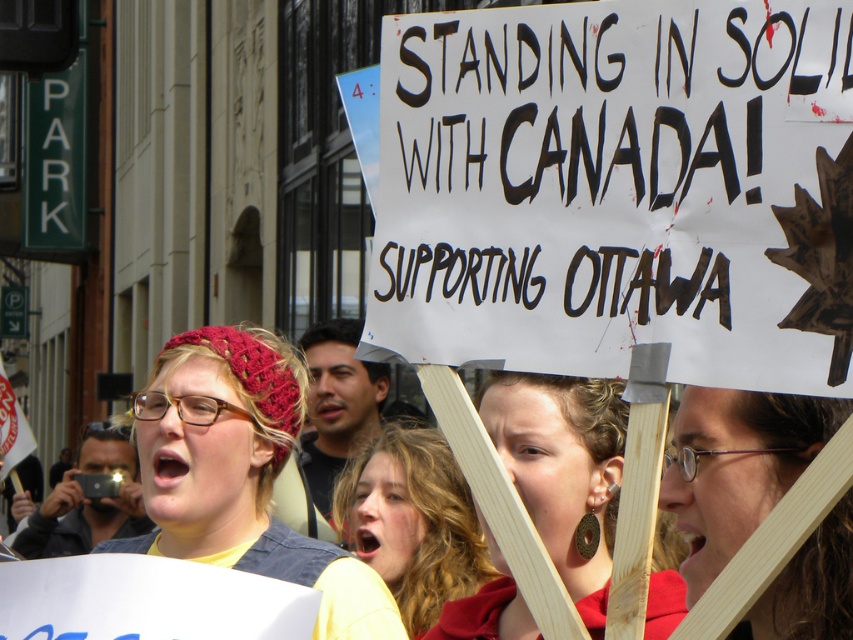
Is point (189, 481) behind point (431, 609)?

No.

Which is behind, point (297, 566) or point (415, 456)?

Positioned behind is point (415, 456).

You are a GUI agent. You are given a task and a screenshot of the screen. Output one action in this format:
    pyautogui.click(x=<x>, y=<y>)
    Task: Click on the knitted red beanie at center
    The width and height of the screenshot is (853, 640).
    Given the screenshot: What is the action you would take?
    click(239, 474)

Is the position of knitted red beanie at center less distant than that of wooden sign at center?

No, it is not.

Who is positioned more to the left, knitted red beanie at center or wooden sign at center?

Positioned to the left is knitted red beanie at center.

Is point (350, 588) positioned in front of point (534, 406)?

No, (350, 588) is further to viewer.

Locate an element on the screen. knitted red beanie at center is located at coordinates (239, 474).

Find the location of `wooden sign at center`. wooden sign at center is located at coordinates (563, 468).

Can you confirm if wooden sign at center is positioned to the left of matte wooden sign at center?

Indeed, wooden sign at center is positioned on the left side of matte wooden sign at center.

Image resolution: width=853 pixels, height=640 pixels. What are the coordinates of `wooden sign at center` in the screenshot? It's located at (563, 468).

Locate an element on the screen. Image resolution: width=853 pixels, height=640 pixels. wooden sign at center is located at coordinates (563, 468).